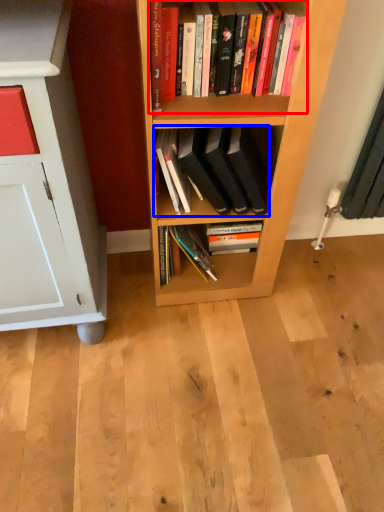
Question: Which point is further to the camera, book (highlighted by a red box) or book (highlighted by a blue box)?

Choices:
 (A) book
 (B) book

Answer: (B)